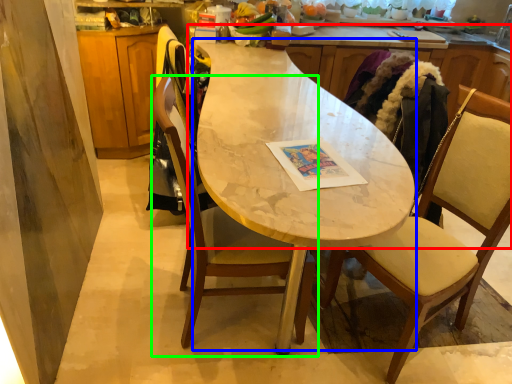
Question: Estimate the real-world distances between objects in this image. Which object is closer to countertop (highlighted by a red box), round table (highlighted by a blue box) or chair (highlighted by a green box)?

Choices:
 (A) round table
 (B) chair

Answer: (A)